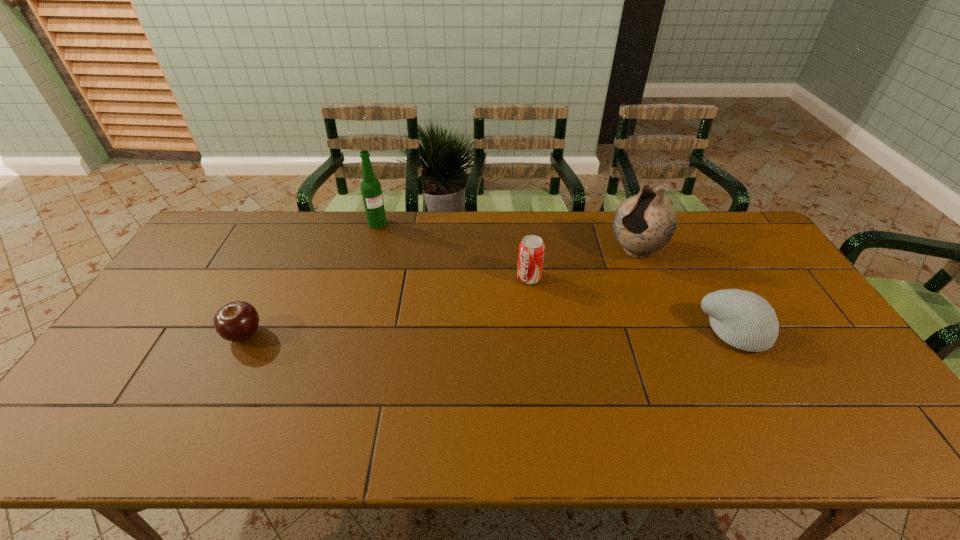
The image size is (960, 540). Find the location of `free space on the desktop that is between the apple and the beanie and is positioned from the spout of the pottery`. free space on the desktop that is between the apple and the beanie and is positioned from the spout of the pottery is located at coordinates (528, 333).

I want to click on free space on the desktop that is between the apple and the beanie and is positioned on the logo side of the third tallest object, so click(468, 334).

At what (x,y) coordinates should I click in order to perform the action: click on vacant space on the desktop that is between the leftmost object and the beanie and is positioned on the label of the fourth object from right to left. Please return your answer as a coordinate pair (x, y). Image resolution: width=960 pixels, height=540 pixels. Looking at the image, I should click on 452,334.